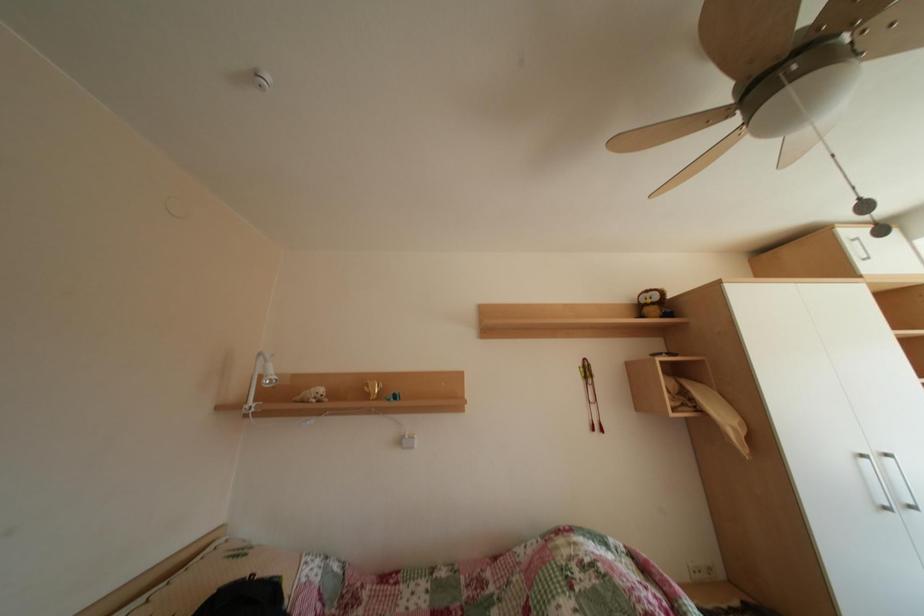
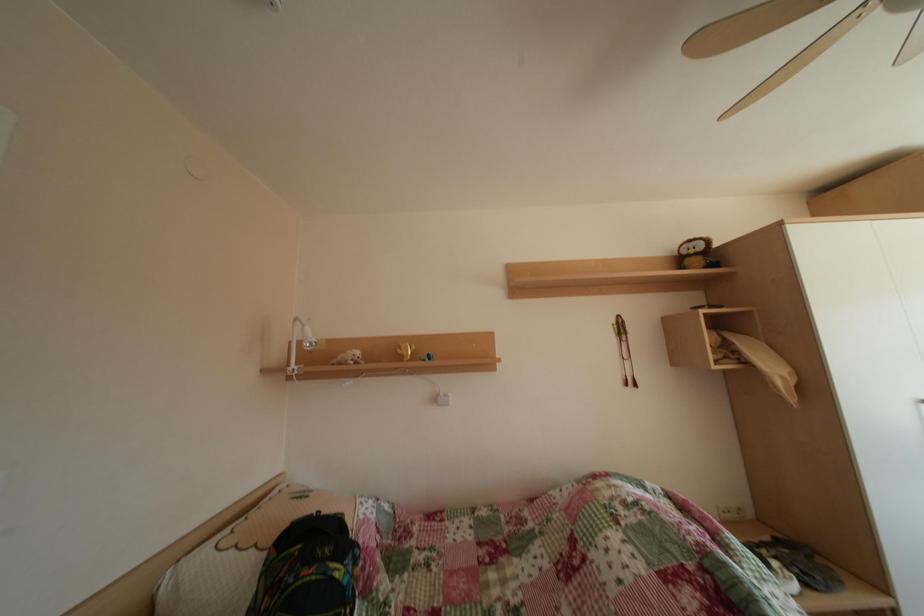
Question: What movement of the cameraman would produce the second image?

Choices:
 (A) Left
 (B) Right
 (C) Forward
 (D) Backward

Answer: (A)